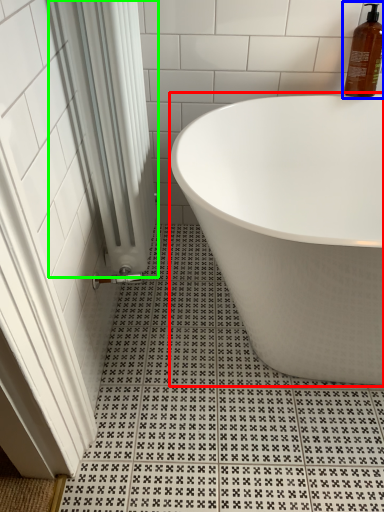
Question: Which is farther away from bathtub (highlighted by a red box)? cleaning product (highlighted by a blue box) or shower curtain (highlighted by a green box)?

Choices:
 (A) cleaning product
 (B) shower curtain

Answer: (A)